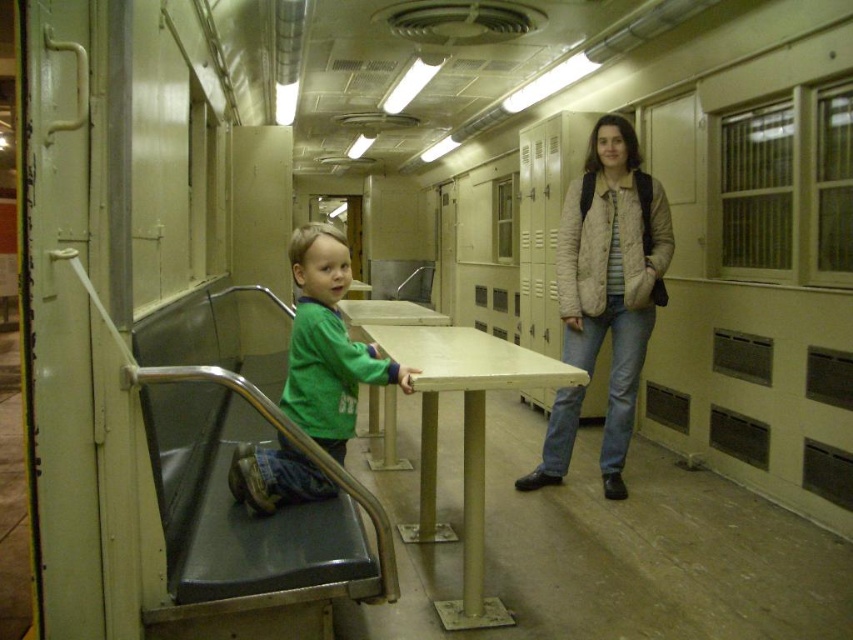
You are standing in the vintage train car and want to reach the point marked as point (x=433, y=420). If your reach extends 1.2 meters, can you touch that point without moving your feet?

The distance between you and point (x=433, y=420) is 3.08 meters. Since your reach only extends 1.2 meters, you cannot touch the point without moving your feet.

You are a tailor who needs to determine which garment requires more fabric based on their height. You see a light beige textured jacket at center and a green matte shirt at center. Which garment is taller?

The light beige textured jacket at center is taller than the green matte shirt at center, so it requires more fabric.

You are a luggage handler in a train station and need to place a 36 inch long package between the light beige textured jacket at center and the matte yellow table at center. Can you fit it there?

The distance between the light beige textured jacket at center and the matte yellow table at center is 36.33 inches, so the 36 inch long package can fit with a small amount of space remaining.